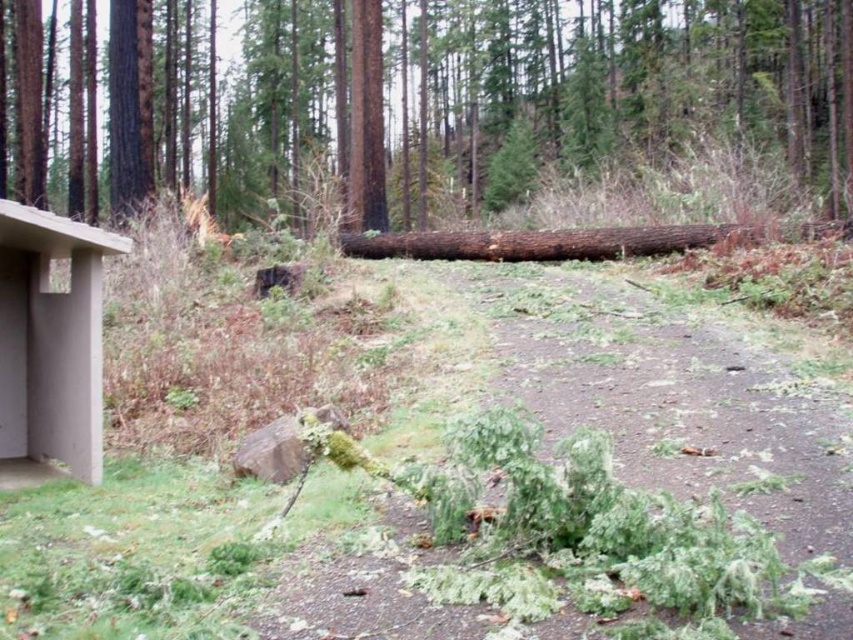
Question: Is green leafy debris at center behind concrete at left?

Choices:
 (A) no
 (B) yes

Answer: (A)

Question: Which object is positioned closest to the concrete at left?

Choices:
 (A) green leafy debris at center
 (B) green mossy log at center

Answer: (A)

Question: Considering the real-world distances, which object is farthest from the green leafy debris at center?

Choices:
 (A) green mossy log at center
 (B) concrete at left

Answer: (A)

Question: Is the position of green mossy log at center more distant than that of concrete at left?

Choices:
 (A) no
 (B) yes

Answer: (B)

Question: Does green mossy log at center appear on the right side of concrete at left?

Choices:
 (A) no
 (B) yes

Answer: (B)

Question: Estimate the real-world distances between objects in this image. Which object is closer to the green mossy log at center?

Choices:
 (A) green leafy debris at center
 (B) concrete at left

Answer: (A)